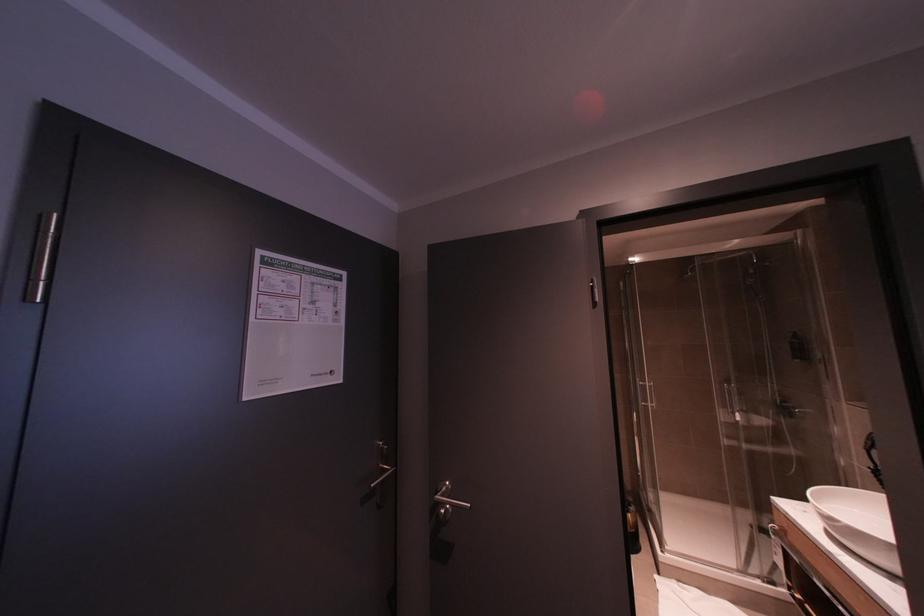
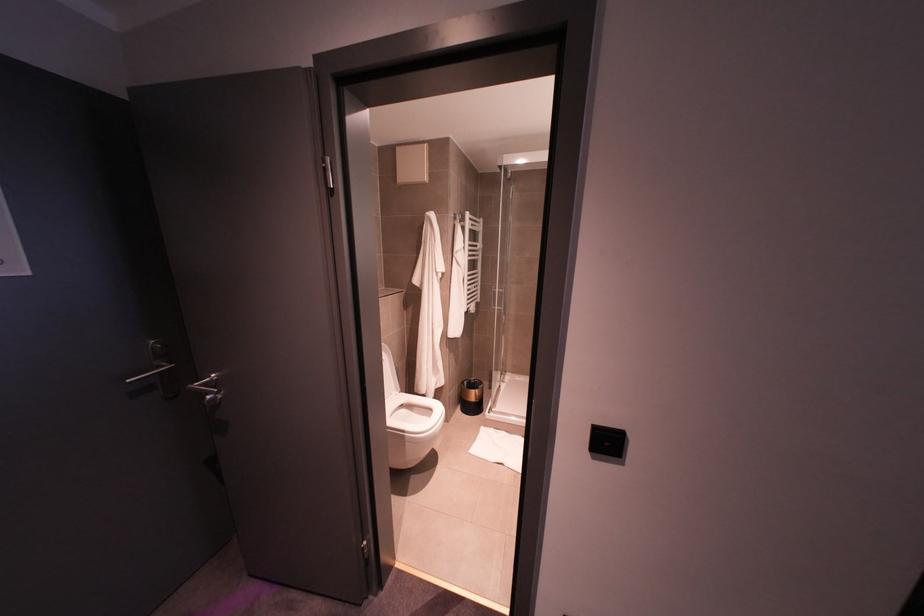
Question: What movement of the cameraman would produce the second image?

Choices:
 (A) Left
 (B) Right
 (C) Forward
 (D) Backward

Answer: (B)